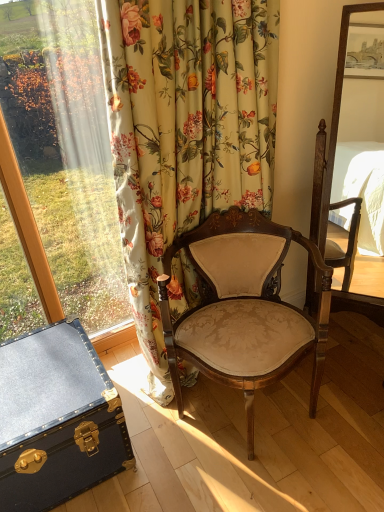
Image resolution: width=384 pixels, height=512 pixels. In order to click on vacant space in front of floral fabric curtain at left in this screenshot , I will do `click(238, 472)`.